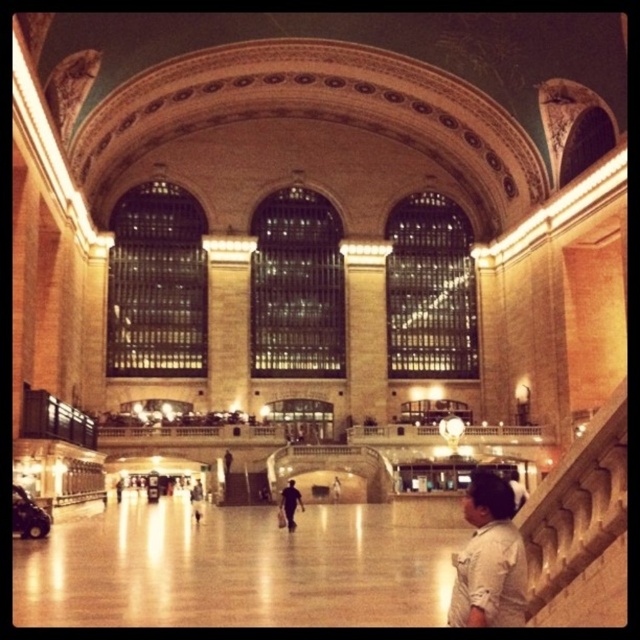
You are standing at the entrance of the grand historic building and want to take a photo of the point at coordinates point [291,481]. If your camera has a maximum focus range of 100 meters, will it be able to focus on that point?

The distance of point [291,481] from the camera is 92.66 meters, which is within the camera maximum focus range of 100 meters. Therefore, the camera can focus on the point.

You are standing at the entrance of the grand historic building and see two points marked on the floor. The first point is at coordinates point (x=285, y=518) and the second is at point (x=198, y=497). Which point is closer to you?

Point (x=285, y=518) is in front of point (x=198, y=497), so it is closer to you.

You are standing in the grand historic building and want to reach a specific point marked at coordinates point (x=470, y=611). If you walk straight ahead, will you reach this point before reaching the arched windows in the background?

The distance of point (x=470, y=611) from viewer is 35.37 meters. Since the arched windows are in the background and the point is 35.37 meters away, you would reach the point before the arched windows if they are farther away. However, without knowing the exact distance to the windows, it cannot be definitively determined.